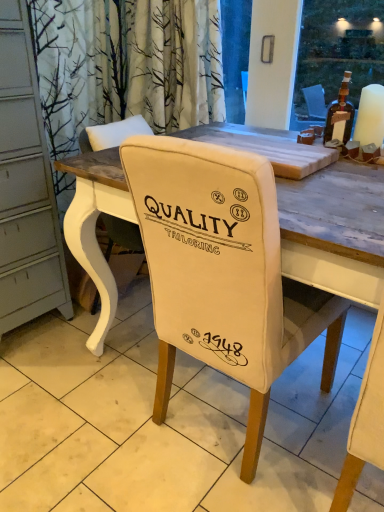
Question: From a real-world perspective, is brown glass bottle at upper right physically located above or below white fabric chair at center?

Choices:
 (A) below
 (B) above

Answer: (B)

Question: Is brown glass bottle at upper right to the left or to the right of white fabric chair at center in the image?

Choices:
 (A) right
 (B) left

Answer: (A)

Question: Which object is positioned farthest from the white fabric chair back at center?

Choices:
 (A) white fabric chair at center
 (B) white matte candle at upper right
 (C) brown glass bottle at upper right

Answer: (C)

Question: Which object is the farthest from the white matte candle at upper right?

Choices:
 (A) brown glass bottle at upper right
 (B) white fabric chair back at center
 (C) white fabric chair at center

Answer: (B)